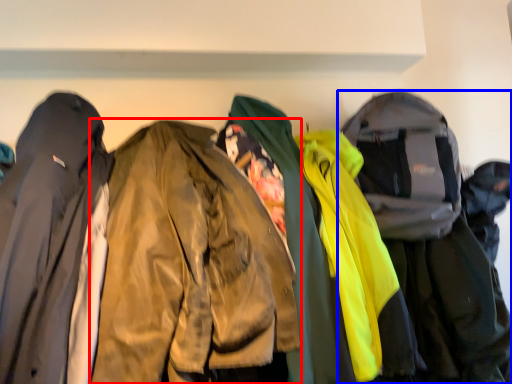
Question: Among these objects, which one is farthest to the camera, jacket (highlighted by a red box) or jacket (highlighted by a blue box)?

Choices:
 (A) jacket
 (B) jacket

Answer: (B)